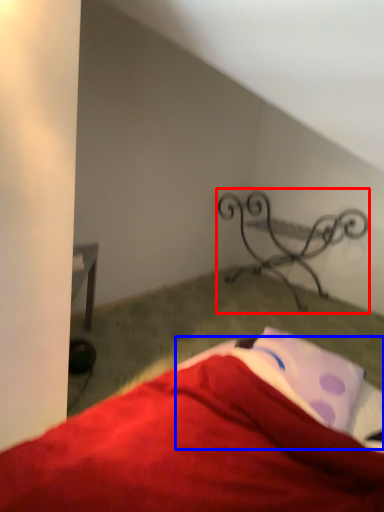
Question: Among these objects, which one is farthest to the camera, furniture (highlighted by a red box) or sheet (highlighted by a blue box)?

Choices:
 (A) furniture
 (B) sheet

Answer: (A)